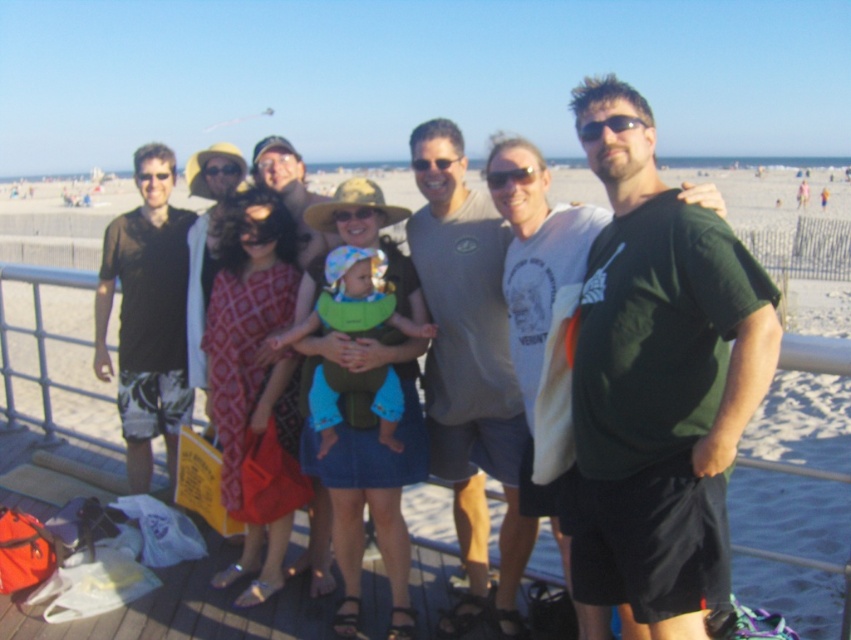
Can you confirm if matte black t-shirt at center is smaller than gray cotton t-shirt at center?

Actually, matte black t-shirt at center might be larger than gray cotton t-shirt at center.

Does matte black t-shirt at center have a greater width compared to gray cotton t-shirt at center?

Indeed, matte black t-shirt at center has a greater width compared to gray cotton t-shirt at center.

Between point (755, 310) and point (447, 157), which one is positioned in front?

Point (755, 310)

Identify the location of matte black t-shirt at center. (655, 381).

Measure the distance between matte black t-shirt at center and camera.

matte black t-shirt at center is 8.15 feet from camera.

Is matte black t-shirt at center below dark green t-shirt at center?

Indeed, matte black t-shirt at center is positioned under dark green t-shirt at center.

Where is `matte black t-shirt at center`? matte black t-shirt at center is located at coordinates (655, 381).

Does gray cotton t-shirt at center have a larger size compared to black fabric shirt at left?

Yes.

Between gray cotton t-shirt at center and black fabric shirt at left, which one appears on the right side from the viewer's perspective?

Positioned to the right is gray cotton t-shirt at center.

Locate an element on the screen. gray cotton t-shirt at center is located at coordinates (469, 372).